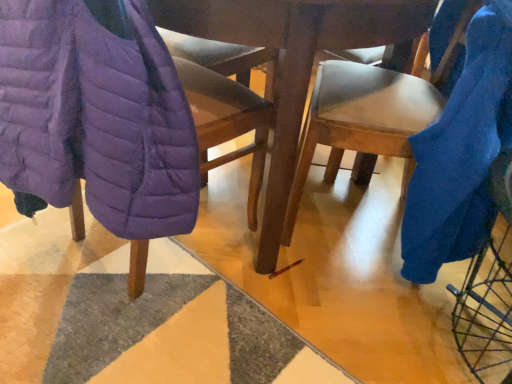
Question: Are purple quilted jacket at left, which is the 2th blanket in right-to-left order, and purple quilted jacket at left, the 1th chair positioned from the left, making contact?

Choices:
 (A) no
 (B) yes

Answer: (A)

Question: Can you confirm if purple quilted jacket at left, which is the 2th blanket in right-to-left order, is shorter than purple quilted jacket at left, which ranks as the second chair in right-to-left order?

Choices:
 (A) no
 (B) yes

Answer: (B)

Question: Does purple quilted jacket at left, which is the 2th blanket in right-to-left order, have a larger size compared to purple quilted jacket at left, the 1th chair positioned from the left?

Choices:
 (A) no
 (B) yes

Answer: (A)

Question: From the image's perspective, would you say purple quilted jacket at left, positioned as the first blanket in left-to-right order, is shown under purple quilted jacket at left, which ranks as the second chair in right-to-left order?

Choices:
 (A) no
 (B) yes

Answer: (A)

Question: Considering the relative sizes of purple quilted jacket at left, which is the 2th blanket in right-to-left order, and purple quilted jacket at left, which ranks as the second chair in right-to-left order, in the image provided, is purple quilted jacket at left, which is the 2th blanket in right-to-left order, smaller than purple quilted jacket at left, which ranks as the second chair in right-to-left order,?

Choices:
 (A) yes
 (B) no

Answer: (A)

Question: From a real-world perspective, is blue fuzzy blanket at right, which is the 2th blanket from left to right, above or below purple quilted jacket at left, which ranks as the second chair in right-to-left order?

Choices:
 (A) above
 (B) below

Answer: (A)

Question: Is blue fuzzy blanket at right, the first blanket positioned from the right, bigger or smaller than purple quilted jacket at left, the 1th chair positioned from the left?

Choices:
 (A) small
 (B) big

Answer: (A)

Question: Considering the positions of blue fuzzy blanket at right, the first blanket positioned from the right, and purple quilted jacket at left, which ranks as the second chair in right-to-left order, in the image, is blue fuzzy blanket at right, the first blanket positioned from the right, wider or thinner than purple quilted jacket at left, which ranks as the second chair in right-to-left order,?

Choices:
 (A) thin
 (B) wide

Answer: (A)

Question: Based on their positions, is blue fuzzy blanket at right, the first blanket positioned from the right, located to the left or right of purple quilted jacket at left, which ranks as the second chair in right-to-left order?

Choices:
 (A) left
 (B) right

Answer: (B)

Question: Considering the positions of purple quilted jacket at left, which is the 2th blanket in right-to-left order, and purple quilted jacket at left, which ranks as the second chair in right-to-left order, in the image, is purple quilted jacket at left, which is the 2th blanket in right-to-left order, wider or thinner than purple quilted jacket at left, which ranks as the second chair in right-to-left order,?

Choices:
 (A) thin
 (B) wide

Answer: (A)

Question: In terms of size, does purple quilted jacket at left, which is the 2th blanket in right-to-left order, appear bigger or smaller than purple quilted jacket at left, the 1th chair positioned from the left?

Choices:
 (A) small
 (B) big

Answer: (A)

Question: Relative to purple quilted jacket at left, which ranks as the second chair in right-to-left order, is purple quilted jacket at left, which is the 2th blanket in right-to-left order, in front or behind?

Choices:
 (A) front
 (B) behind

Answer: (A)

Question: Is point (51, 48) closer or farther from the camera than point (231, 152)?

Choices:
 (A) closer
 (B) farther

Answer: (A)

Question: Considering the positions of purple quilted jacket at left, positioned as the first blanket in left-to-right order, and blue fabric chair at right, positioned as the 2th chair in left-to-right order, in the image, is purple quilted jacket at left, positioned as the first blanket in left-to-right order, wider or thinner than blue fabric chair at right, positioned as the 2th chair in left-to-right order,?

Choices:
 (A) thin
 (B) wide

Answer: (A)

Question: Would you say purple quilted jacket at left, which is the 2th blanket in right-to-left order, is to the left or to the right of blue fabric chair at right, the first chair when ordered from right to left, in the picture?

Choices:
 (A) right
 (B) left

Answer: (B)